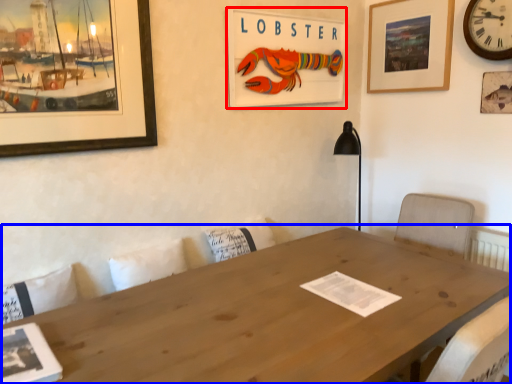
Question: Which object appears farthest to the camera in this image, picture frame (highlighted by a red box) or table (highlighted by a blue box)?

Choices:
 (A) picture frame
 (B) table

Answer: (A)